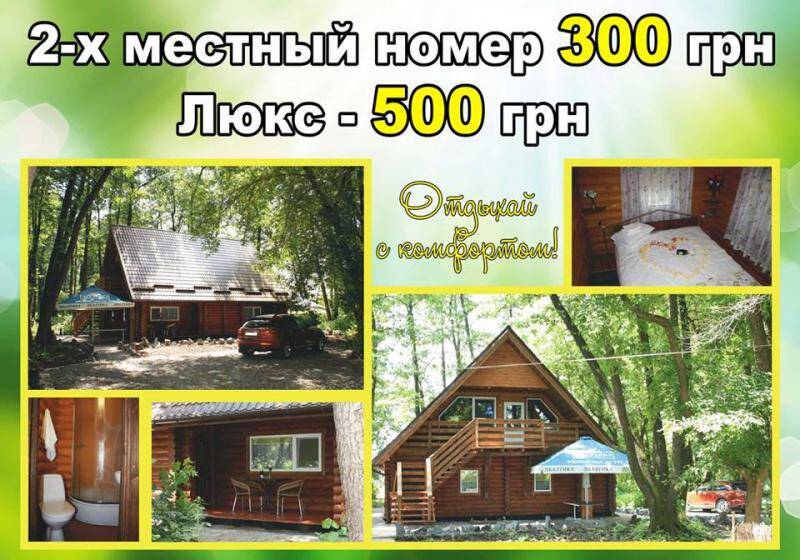
The width and height of the screenshot is (800, 560). I want to click on window, so click(458, 410).